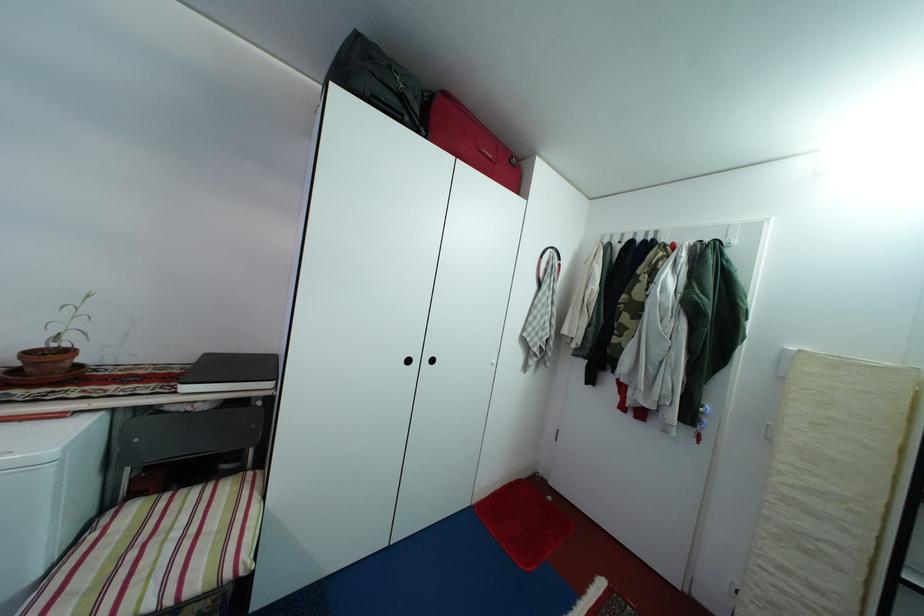
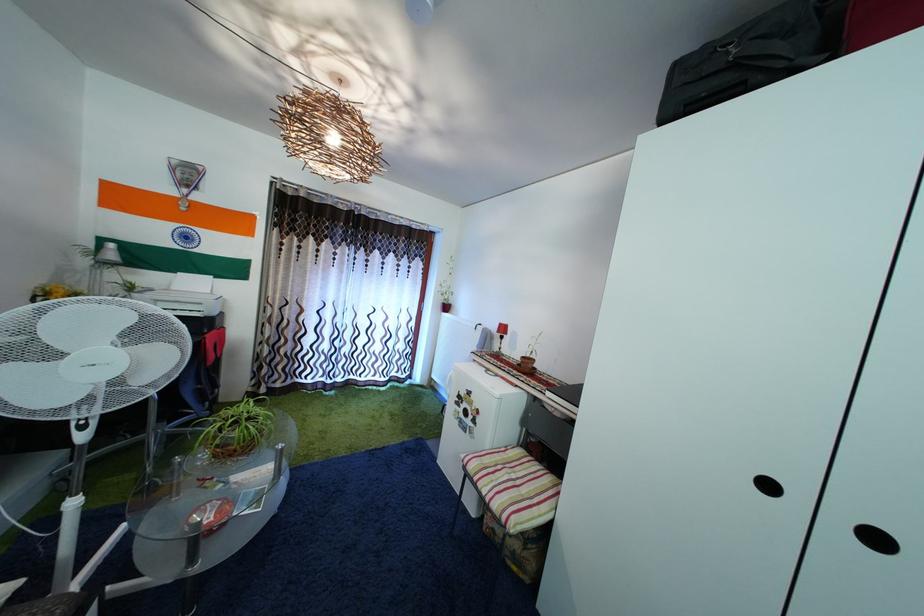
Question: Based on the continuous images, in which direction is the camera rotating? Reply with the corresponding letter.

Choices:
 (A) Left
 (B) Right
 (C) Up
 (D) Down

Answer: (A)